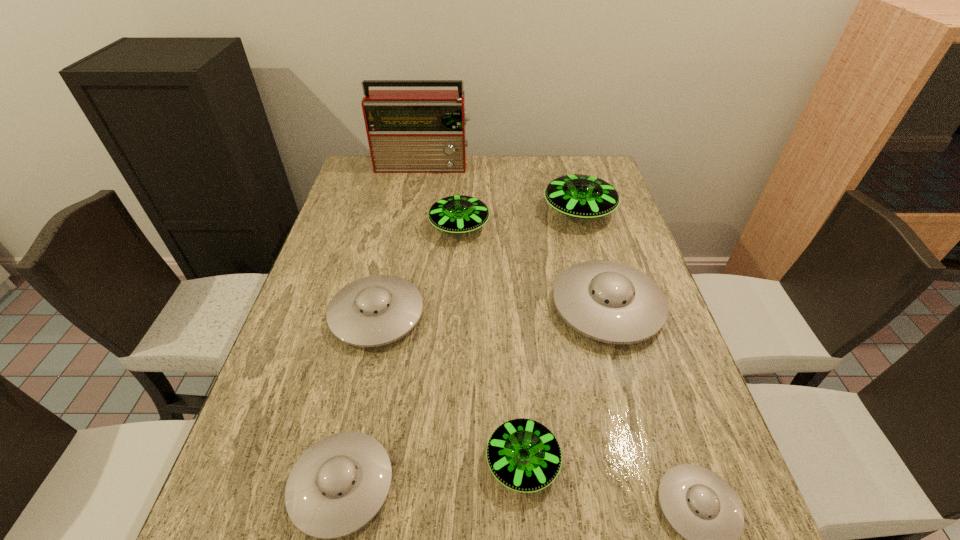
Locate an element on the screen. Image resolution: width=960 pixels, height=540 pixels. free space located on the back of the second smallest green saucer is located at coordinates (462, 186).

The image size is (960, 540). What are the coordinates of `vacant space located on the left of the biggest gray saucer` in the screenshot? It's located at (410, 307).

You are a GUI agent. You are given a task and a screenshot of the screen. Output one action in this format:
    pyautogui.click(x=<x>, y=<y>)
    Task: Click on the free space located on the right of the third smallest gray saucer
    The image size is (960, 540).
    Given the screenshot: What is the action you would take?
    pyautogui.click(x=588, y=315)

You are a GUI agent. You are given a task and a screenshot of the screen. Output one action in this format:
    pyautogui.click(x=<x>, y=<y>)
    Task: Click on the vacant space located on the right of the nearest green saucer
    
    Given the screenshot: What is the action you would take?
    pyautogui.click(x=613, y=462)

Identify the location of radio receiver that is at the far edge. (409, 131).

The image size is (960, 540). I want to click on saucer that is at the far edge, so click(x=581, y=196).

This screenshot has height=540, width=960. Identify the location of radio receiver present at the left edge. pos(409,131).

Locate an element on the screen. The height and width of the screenshot is (540, 960). saucer located in the left edge section of the desktop is located at coordinates (376, 310).

Where is `object at the far left corner`? object at the far left corner is located at coordinates (409, 131).

Locate an element on the screen. The image size is (960, 540). object at the far right corner is located at coordinates (581, 196).